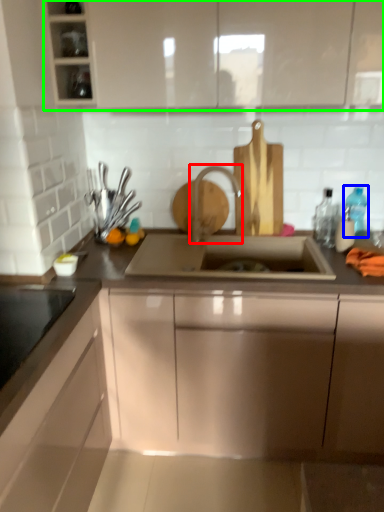
Question: Which object is the farthest from tap (highlighted by a red box)? Choose among these: bottle (highlighted by a blue box) or cabinetry (highlighted by a green box).

Choices:
 (A) bottle
 (B) cabinetry

Answer: (A)